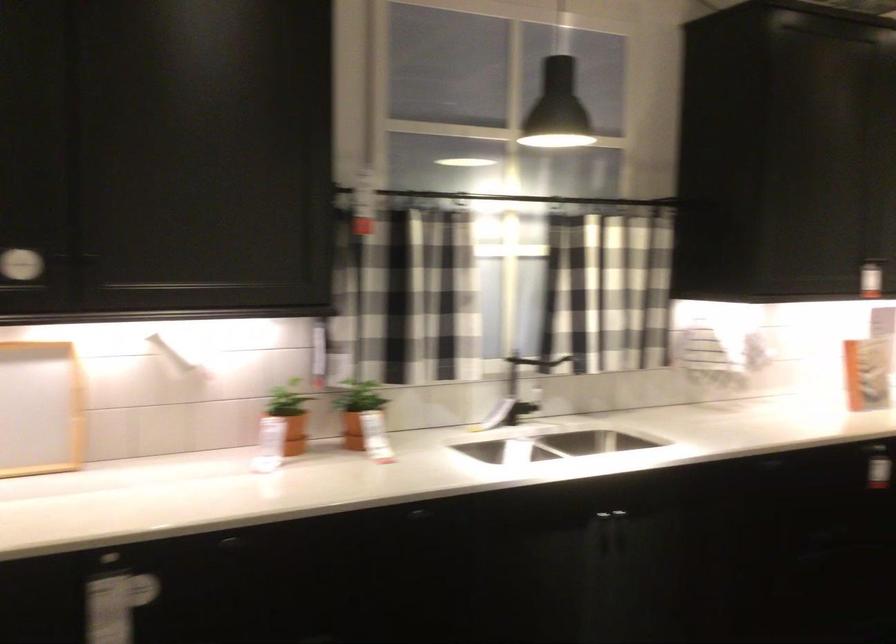
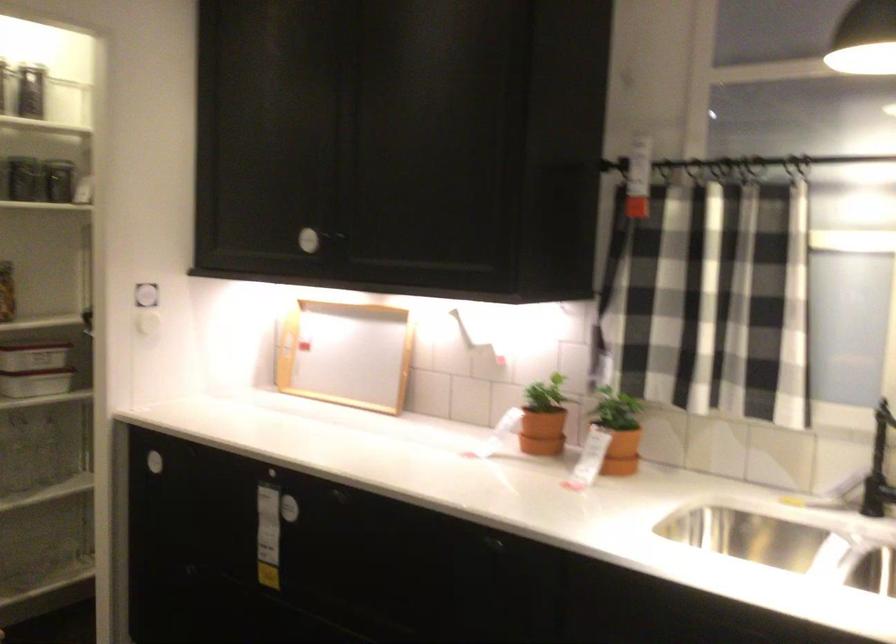
Where in the second image is the point corresponding to point 299,433 from the first image?

(541, 431)